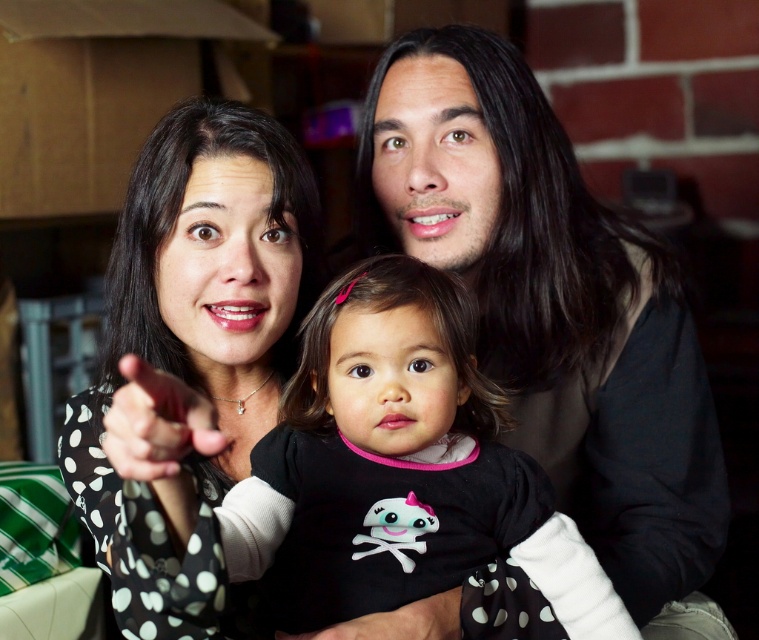
Question: Is black polka dot onesie at center wider than black dotted shirt at center?

Choices:
 (A) yes
 (B) no

Answer: (A)

Question: Which of the following is the farthest from the observer?

Choices:
 (A) (150, 250)
 (B) (553, 586)

Answer: (A)

Question: Is smooth black shirt at center below black polka dot onesie at center?

Choices:
 (A) no
 (B) yes

Answer: (A)

Question: Which is nearer to the black polka dot onesie at center?

Choices:
 (A) black dotted shirt at center
 (B) smooth black shirt at center

Answer: (A)

Question: Among these points, which one is farthest from the camera?

Choices:
 (A) (358, 420)
 (B) (452, 616)
 (C) (128, 218)

Answer: (C)

Question: Can you confirm if smooth black shirt at center is wider than black polka dot onesie at center?

Choices:
 (A) no
 (B) yes

Answer: (B)